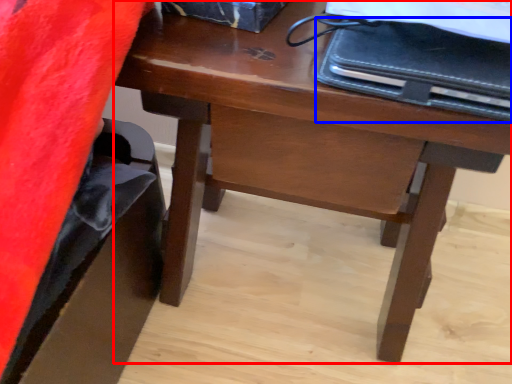
Question: Among these objects, which one is farthest to the camera, desk (highlighted by a red box) or notebook (highlighted by a blue box)?

Choices:
 (A) desk
 (B) notebook

Answer: (A)